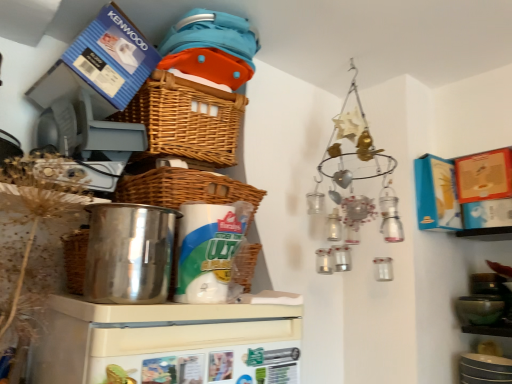
Question: Does woven brown basket at center, the 2th basket positioned from the top, have a larger size compared to polished stainless steel pot at left, the first appliance from the top?

Choices:
 (A) yes
 (B) no

Answer: (A)

Question: From the image's perspective, is woven brown basket at center, which is the first basket from bottom to top, under polished stainless steel pot at left, the first appliance from the top?

Choices:
 (A) yes
 (B) no

Answer: (B)

Question: Would you say woven brown basket at center, which is the first basket from bottom to top, contains polished stainless steel pot at left, which is the 2th appliance from bottom to top?

Choices:
 (A) no
 (B) yes

Answer: (A)

Question: Could you tell me if woven brown basket at center, the 2th basket positioned from the top, is facing polished stainless steel pot at left, which is the 2th appliance from bottom to top?

Choices:
 (A) yes
 (B) no

Answer: (B)

Question: Is woven brown basket at center, which is the first basket from bottom to top, placed right next to polished stainless steel pot at left, which is the 2th appliance from bottom to top?

Choices:
 (A) no
 (B) yes

Answer: (A)

Question: Based on their sizes in the image, would you say woven brown basket at upper center, positioned as the second basket in bottom-to-top order, is bigger or smaller than woven brown basket at center, the 2th basket positioned from the top?

Choices:
 (A) big
 (B) small

Answer: (A)

Question: Considering the relative positions of woven brown basket at upper center, positioned as the second basket in bottom-to-top order, and woven brown basket at center, the 2th basket positioned from the top, in the image provided, is woven brown basket at upper center, positioned as the second basket in bottom-to-top order, to the left or to the right of woven brown basket at center, the 2th basket positioned from the top,?

Choices:
 (A) right
 (B) left

Answer: (B)

Question: From a real-world perspective, is woven brown basket at upper center, positioned as the second basket in bottom-to-top order, physically located above or below woven brown basket at center, the 2th basket positioned from the top?

Choices:
 (A) above
 (B) below

Answer: (A)

Question: Does point (207, 152) appear closer or farther from the camera than point (219, 188)?

Choices:
 (A) farther
 (B) closer

Answer: (A)

Question: Is woven brown basket at upper center, which ranks as the 1th basket in top-to-bottom order, situated inside white plastic refrigerator at center, which is the second appliance in top-to-bottom order, or outside?

Choices:
 (A) outside
 (B) inside

Answer: (A)

Question: From a real-world perspective, relative to white plastic refrigerator at center, which ranks as the first appliance in bottom-to-top order, is woven brown basket at upper center, which ranks as the 1th basket in top-to-bottom order, vertically above or below?

Choices:
 (A) above
 (B) below

Answer: (A)

Question: Is woven brown basket at upper center, which ranks as the 1th basket in top-to-bottom order, taller or shorter than white plastic refrigerator at center, which is the second appliance in top-to-bottom order?

Choices:
 (A) tall
 (B) short

Answer: (B)

Question: Is woven brown basket at upper center, positioned as the second basket in bottom-to-top order, wider or thinner than white plastic refrigerator at center, which ranks as the first appliance in bottom-to-top order?

Choices:
 (A) wide
 (B) thin

Answer: (B)

Question: From a real-world perspective, relative to woven brown basket at upper center, which ranks as the 1th basket in top-to-bottom order, is polished stainless steel pot at left, the first appliance from the top, vertically above or below?

Choices:
 (A) above
 (B) below

Answer: (B)

Question: In the image, is polished stainless steel pot at left, the first appliance from the top, on the left side or the right side of woven brown basket at upper center, positioned as the second basket in bottom-to-top order?

Choices:
 (A) right
 (B) left

Answer: (B)